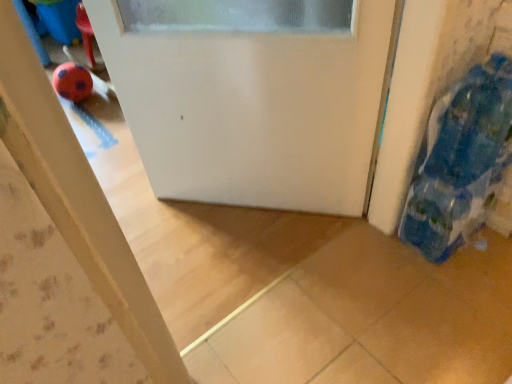
Question: Considering the positions of white matte door at center and blue fabric bag at right in the image, is white matte door at center taller or shorter than blue fabric bag at right?

Choices:
 (A) tall
 (B) short

Answer: (A)

Question: Considering the relative positions of white matte door at center and blue fabric bag at right in the image provided, is white matte door at center to the left or to the right of blue fabric bag at right?

Choices:
 (A) left
 (B) right

Answer: (A)

Question: Considering their positions, is white matte door at center located in front of or behind blue fabric bag at right?

Choices:
 (A) front
 (B) behind

Answer: (B)

Question: From a real-world perspective, relative to white matte door at center, is blue fabric bag at right vertically above or below?

Choices:
 (A) below
 (B) above

Answer: (B)

Question: Do you think blue fabric bag at right is within white matte door at center, or outside of it?

Choices:
 (A) inside
 (B) outside

Answer: (B)

Question: Considering the positions of point (476, 170) and point (379, 86), is point (476, 170) closer or farther from the camera than point (379, 86)?

Choices:
 (A) farther
 (B) closer

Answer: (A)

Question: In terms of size, does blue fabric bag at right appear bigger or smaller than white matte door at center?

Choices:
 (A) big
 (B) small

Answer: (B)